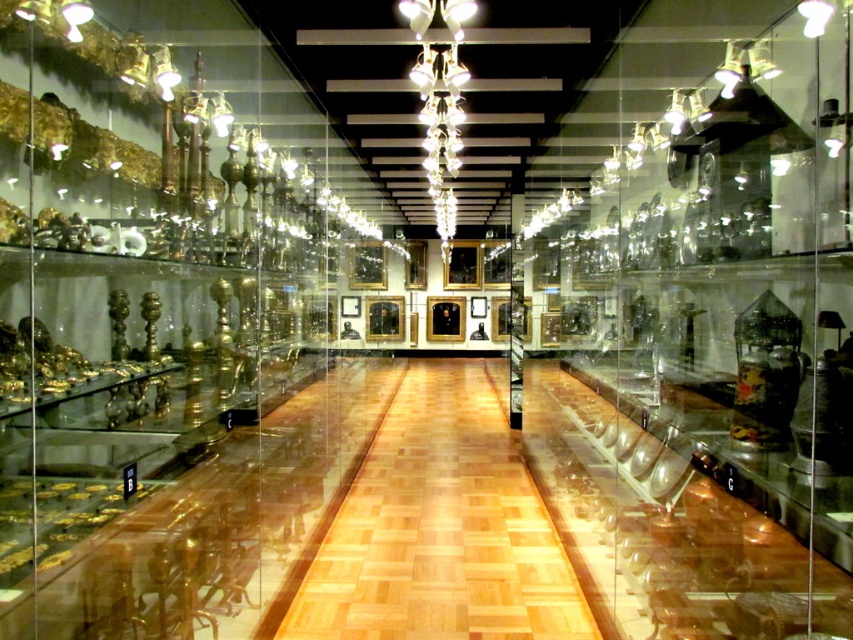
You are an interior designer planning to install a new light fixture in the hallway. The clear glass display case at center and the white glass chandelier at center are both in the central area. Which object should you consider in terms of size when deciding where to place the new fixture?

The clear glass display case at center has a larger size compared to the white glass chandelier at center. Therefore, you should consider the clear glass display case at center when deciding where to place the new fixture due to its larger size.

You are a maintenance worker needing to replace a bulb in the white glass chandelier at center. You have a ladder that is 6 feet tall. The clear glass display case at center is directly below the chandelier. Can you safely reach the chandelier without knocking over the display case?

The distance between the clear glass display case at center and white glass chandelier at center is 6.63 feet. Since the ladder is only 6 feet tall, it is not tall enough to reach the chandelier safely. Additionally, the display case being directly below would block access, making it unsafe to attempt without moving the case first.

You are standing at the entrance of the hallway and see two points marked in the image. Which point, point (799, 358) or point (451, 211), is closer to you?

Point (799, 358) is closer to the camera than point (451, 211), so it is closer to you.